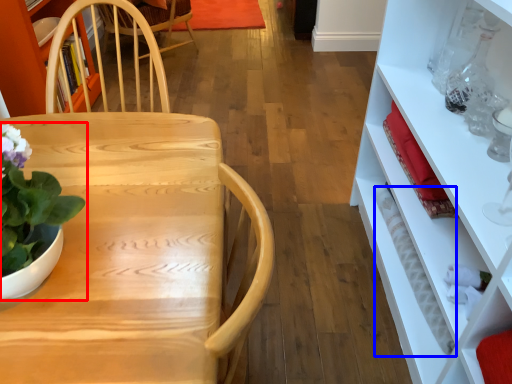
Question: Which point is further to the camera, houseplant (highlighted by a red box) or bottle (highlighted by a blue box)?

Choices:
 (A) houseplant
 (B) bottle

Answer: (B)